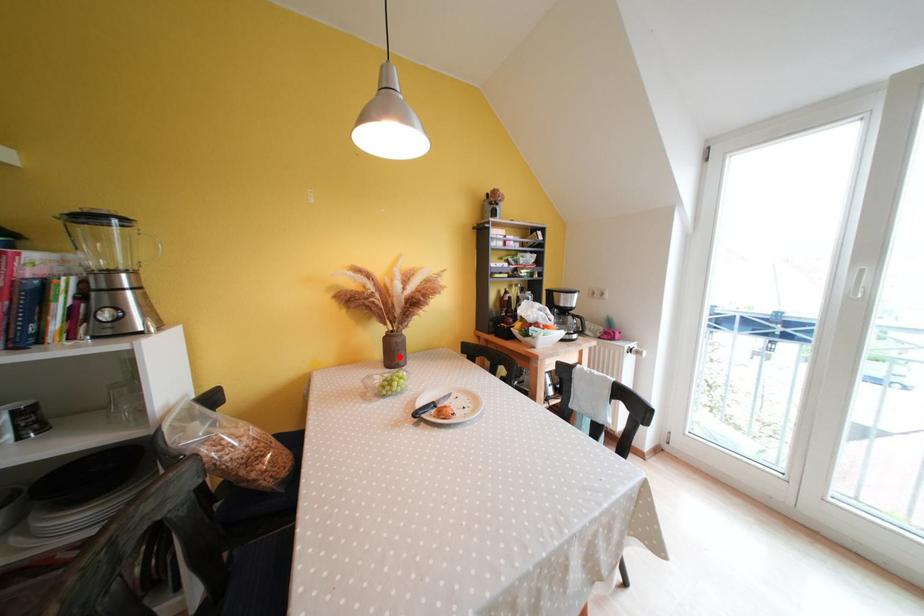
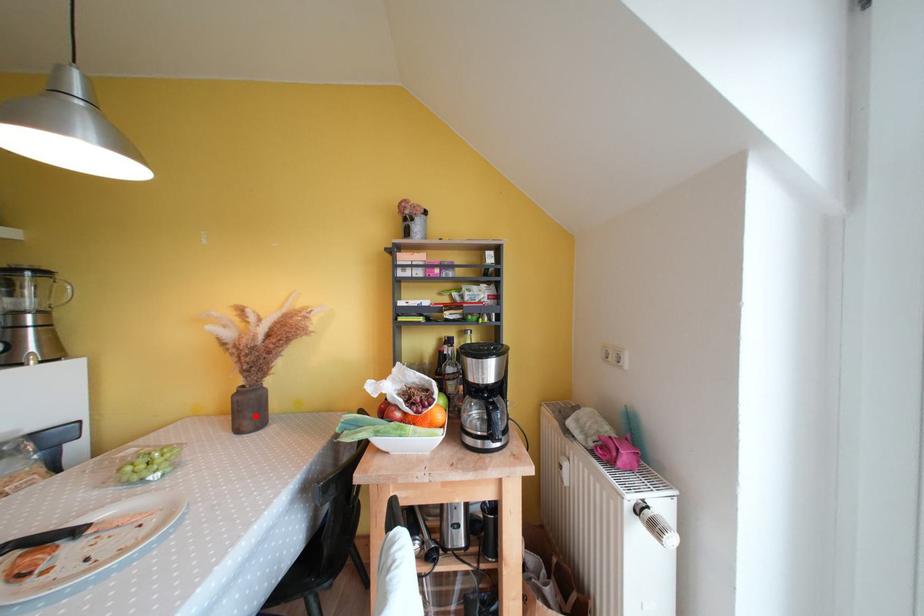
I am providing you with two images of the same scene from different viewpoints. A red point is marked on the first image and another point is marked on the second image. Does the point marked in image1 correspond to the same location as the one in image2?

Yes